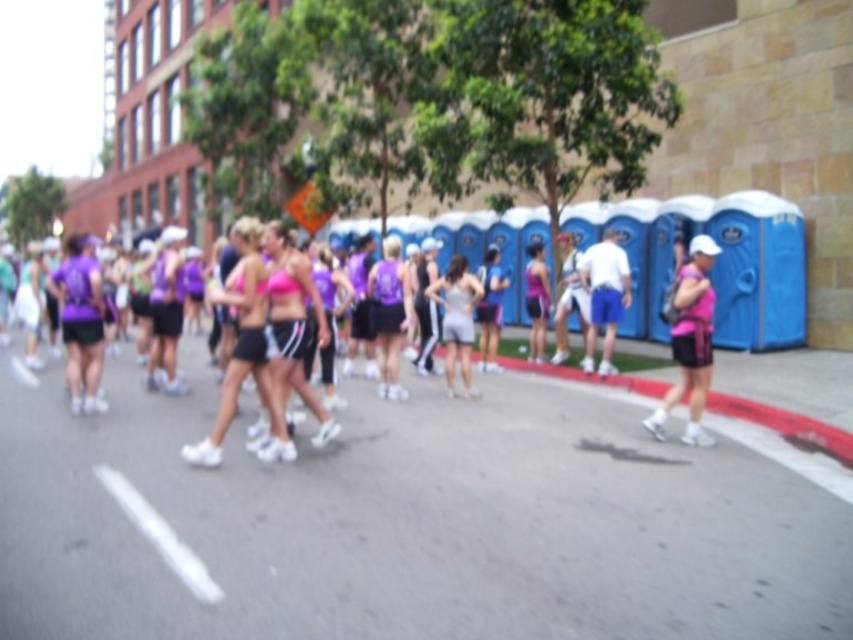
You are a photographer at the marathon and want to capture both the purple matte tank top at center and the matte gray tank top at center in a single shot. Which direction should you position yourself relative to the participants to ensure both are visible?

You should position yourself to the right of the participants so that both the purple matte tank top at center and the matte gray tank top at center are visible, as the purple one is to the left of the gray one.

You are a photographer positioned at the camera location. You want to capture a photo of the purple matte tank top at center. Considering the distance, will you need to use a zoom lens to ensure the subject is clear and fills the frame?

The purple matte tank top at center is 33.48 feet away from the camera. To ensure the subject is clear and fills the frame from that distance, a zoom lens would be necessary.

You are a photographer at the marathon and want to capture both the pink matte tank top at center and the matte gray tank top at center in a single frame. Which direction should you move to ensure both are visible?

Move to the left so that both the pink matte tank top at center and the matte gray tank top at center come into view, as the pink one is to the right of the gray one.